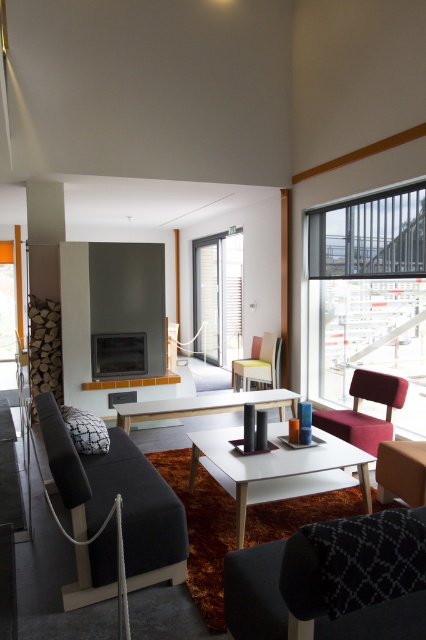
You are sitting on the yellow fabric armchair at center and want to look out through the matte gray window at center. Is the window above or below you?

The matte gray window at center is above the yellow fabric armchair at center, so the window is above you.

You are standing in the living room and want to place a 3.3 foot tall potted plant on the white glossy table at center. Can you safely walk to the table and place the plant without needing to bend down?

The distance between you and the white glossy table at center is 8.91 feet, which is sufficient to walk to the table. However, the height of the table is not provided, so we cannot confirm if bending down is necessary.

You are planning to place a 12 inch tall decorative statue on the table. Which table between the white glossy table at center and the white wooden table at center can accommodate the statue without it exceeding the table height?

The white glossy table at center is taller than the white wooden table at center, so the statue can be placed on the white glossy table at center as it has sufficient height to accommodate the statue without exceeding its height.